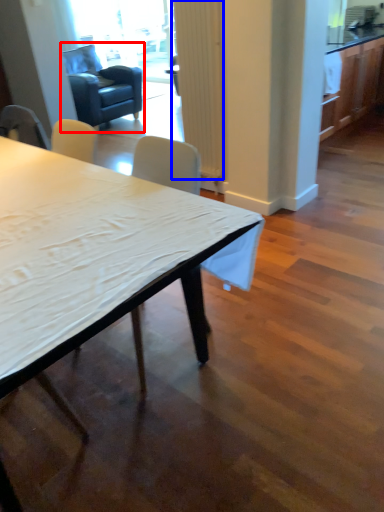
Question: Which point is closer to the camera, swivel chair (highlighted by a red box) or curtain (highlighted by a blue box)?

Choices:
 (A) swivel chair
 (B) curtain

Answer: (B)